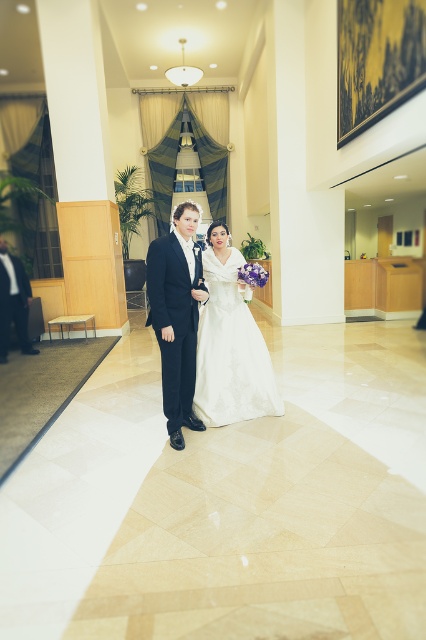
In the wedding scene, there is a point marked at coordinates (230,342). What object is located at this point?

The point at coordinates (230,342) marks the location of the white satin dress at center.

You are a photographer standing at the back of the wedding venue. You want to take a photo that includes both the point at coordinates point (235, 348) and the point at coordinates point (11, 260). Which point will appear larger in your photo?

Point (235, 348) is closer to the camera than point (11, 260), so it will appear larger in the photo.